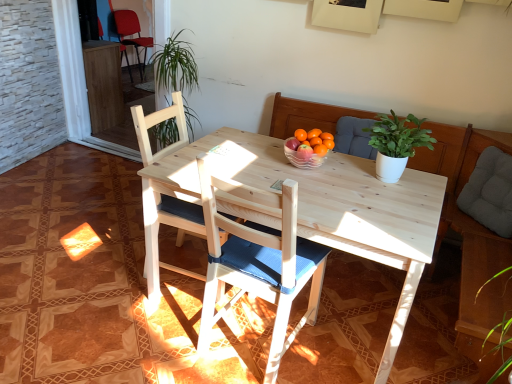
The image size is (512, 384). I want to click on matte red chair at upper left, the third chair in the front-to-back sequence, so click(x=132, y=34).

What do you see at coordinates (259, 262) in the screenshot? This screenshot has width=512, height=384. I see `wooden chair with blue cushion at center, the third chair in the left-to-right sequence` at bounding box center [259, 262].

What do you see at coordinates (169, 225) in the screenshot?
I see `wooden chair at center, which appears as the 2th chair when ordered from the bottom` at bounding box center [169, 225].

You are a GUI agent. You are given a task and a screenshot of the screen. Output one action in this format:
    pyautogui.click(x=<x>, y=<y>)
    Task: Click on the clear glass bowl at center
    The image size is (512, 384).
    Given the screenshot: What is the action you would take?
    pyautogui.click(x=303, y=159)

What do you see at coordinates (303, 159) in the screenshot? The width and height of the screenshot is (512, 384). I see `clear glass bowl at center` at bounding box center [303, 159].

This screenshot has width=512, height=384. I want to click on matte red chair at upper left, the first chair positioned from the back, so click(132, 34).

Which is in front, point (311, 156) or point (148, 47)?

The point (311, 156) is closer to the camera.

From the image's perspective, which one is positioned higher, clear glass bowl at center or matte red chair at upper left, positioned as the first chair in top-to-bottom order?

matte red chair at upper left, positioned as the first chair in top-to-bottom order, appears higher in the image.

Is clear glass bowl at center in contact with matte red chair at upper left, the 3th chair ordered from the bottom?

There is a gap between clear glass bowl at center and matte red chair at upper left, the 3th chair ordered from the bottom.

Between gray fabric cushion at right and clear glass bowl at center, which one is positioned in front?

clear glass bowl at center.

Considering the sizes of objects gray fabric cushion at right and clear glass bowl at center in the image provided, who is smaller, gray fabric cushion at right or clear glass bowl at center?

With smaller size is clear glass bowl at center.

Can you tell me how much gray fabric cushion at right and clear glass bowl at center differ in facing direction?

46.2 degrees.

Could you tell me if gray fabric cushion at right is turned towards clear glass bowl at center?

Yes, gray fabric cushion at right is turned towards clear glass bowl at center.

Does clear glass bowl at center have a larger size compared to wooden chair at center, marked as the second chair in a back-to-front arrangement?

Incorrect, clear glass bowl at center is not larger than wooden chair at center, marked as the second chair in a back-to-front arrangement.

Considering their positions, is clear glass bowl at center located in front of or behind wooden chair at center, which appears as the 2th chair when ordered from the bottom?

In the image, clear glass bowl at center appears behind wooden chair at center, which appears as the 2th chair when ordered from the bottom.

Considering the sizes of objects clear glass bowl at center and wooden chair at center, which is counted as the 2th chair, starting from the front, in the image provided, who is wider, clear glass bowl at center or wooden chair at center, which is counted as the 2th chair, starting from the front,?

With larger width is wooden chair at center, which is counted as the 2th chair, starting from the front.

You are a GUI agent. You are given a task and a screenshot of the screen. Output one action in this format:
    pyautogui.click(x=<x>, y=<y>)
    Task: Click on the 2nd chair counting from the left of the clear glass bowl at center
    Image resolution: width=512 pixels, height=384 pixels.
    Given the screenshot: What is the action you would take?
    tap(169, 225)

Between matte red chair at upper left, the first chair positioned from the back, and clear glass bowl at center, which one has larger size?

matte red chair at upper left, the first chair positioned from the back, is bigger.

From a real-world perspective, is matte red chair at upper left, the 3th chair ordered from the bottom, above or below clear glass bowl at center?

matte red chair at upper left, the 3th chair ordered from the bottom, is below clear glass bowl at center.

The width and height of the screenshot is (512, 384). Identify the location of bowl in front of the matte red chair at upper left, the third chair positioned from the right. (303, 159).

Based on the photo, is matte red chair at upper left, the third chair in the front-to-back sequence, at the left side of clear glass bowl at center?

Yes.

Based on the photo, in terms of width, does gray fabric cushion at right look wider or thinner when compared to wooden chair at center, the 2th chair in the top-to-bottom sequence?

gray fabric cushion at right is thinner than wooden chair at center, the 2th chair in the top-to-bottom sequence.

From a real-world perspective, between gray fabric cushion at right and wooden chair at center, the 2th chair when ordered from left to right, who is vertically lower?

wooden chair at center, the 2th chair when ordered from left to right, from a real-world perspective.

Is gray fabric cushion at right oriented away from wooden chair at center, the 2th chair in the top-to-bottom sequence?

No, gray fabric cushion at right is not facing the opposite direction of wooden chair at center, the 2th chair in the top-to-bottom sequence.

How distant is gray fabric cushion at right from wooden chair at center, which is counted as the 2th chair, starting from the front?

4.70 feet.

From a real-world perspective, is gray fabric cushion at right below matte red chair at upper left, positioned as the first chair in top-to-bottom order?

No, from a real-world perspective, gray fabric cushion at right is not below matte red chair at upper left, positioned as the first chair in top-to-bottom order.

In the scene shown: From the image's perspective, which is above, gray fabric cushion at right or matte red chair at upper left, the third chair positioned from the right?

From the image's view, matte red chair at upper left, the third chair positioned from the right, is above.

What's the angular difference between gray fabric cushion at right and matte red chair at upper left, the 3th chair ordered from the bottom,'s facing directions?

There is a 129-degree angle between the facing directions of gray fabric cushion at right and matte red chair at upper left, the 3th chair ordered from the bottom.

Does point (508, 176) lie behind point (134, 14)?

No, (508, 176) is closer to viewer.

Is wooden chair at center, the 2th chair in the top-to-bottom sequence, to the right of matte red chair at upper left, the first chair positioned from the back, from the viewer's perspective?

Correct, you'll find wooden chair at center, the 2th chair in the top-to-bottom sequence, to the right of matte red chair at upper left, the first chair positioned from the back.

Is wooden chair at center, which is counted as the 2th chair, starting from the front, completely or partially outside of matte red chair at upper left, the third chair positioned from the right?

wooden chair at center, which is counted as the 2th chair, starting from the front, is positioned outside matte red chair at upper left, the third chair positioned from the right.

Is point (154, 156) positioned in front of point (128, 31)?

Yes, point (154, 156) is closer to viewer.

Locate an element on the screen. This screenshot has width=512, height=384. chair that is the 1st one when counting rightward from the matte red chair at upper left, the 1th chair from the left is located at coordinates (169, 225).

Image resolution: width=512 pixels, height=384 pixels. I want to click on bowl lying below the matte red chair at upper left, the 1th chair from the left (from the image's perspective), so click(x=303, y=159).

At what (x,y) coordinates should I click in order to perform the action: click on bowl positioned vertically above the gray fabric cushion at right (from a real-world perspective). Please return your answer as a coordinate pair (x, y). The image size is (512, 384). Looking at the image, I should click on [303, 159].

Estimate the real-world distances between objects in this image. Which object is closer to wooden chair at center, which appears as the 2th chair when ordered from the bottom, matte red chair at upper left, the 3th chair ordered from the bottom, or clear glass bowl at center?

clear glass bowl at center is closer to wooden chair at center, which appears as the 2th chair when ordered from the bottom.

Which object lies further to the anchor point matte red chair at upper left, the first chair positioned from the back, gray fabric cushion at right or clear glass bowl at center?

gray fabric cushion at right is positioned further to the anchor matte red chair at upper left, the first chair positioned from the back.

Based on their spatial positions, is wooden chair at center, the 2th chair when ordered from left to right, or white matte plant at upper center closer to gray fabric cushion at right?

The object closer to gray fabric cushion at right is white matte plant at upper center.

Which object lies nearer to the anchor point wooden chair with blue cushion at center, which is the 1th chair in front-to-back order, wooden chair at center, the 2th chair in the top-to-bottom sequence, or gray fabric cushion at right?

wooden chair at center, the 2th chair in the top-to-bottom sequence, lies closer to wooden chair with blue cushion at center, which is the 1th chair in front-to-back order, than the other object.

From the image, which object appears to be farther from gray fabric cushion at right, clear glass bowl at center or wooden chair with blue cushion at center, the third chair from the top?

wooden chair with blue cushion at center, the third chair from the top.

From the image, which object appears to be nearer to wooden chair at center, the second chair positioned from the right, wooden chair with blue cushion at center, the first chair when ordered from right to left, or clear glass bowl at center?

Based on the image, wooden chair with blue cushion at center, the first chair when ordered from right to left, appears to be nearer to wooden chair at center, the second chair positioned from the right.

Which object lies further to the anchor point matte red chair at upper left, positioned as the first chair in top-to-bottom order, white matte plant at upper center or wooden chair at center, the 2th chair when ordered from left to right?

The object further to matte red chair at upper left, positioned as the first chair in top-to-bottom order, is white matte plant at upper center.

Based on their spatial positions, is gray fabric cushion at right or matte red chair at upper left, the third chair in the front-to-back sequence, closer to wooden chair at center, the second chair positioned from the right?

The object closer to wooden chair at center, the second chair positioned from the right, is gray fabric cushion at right.

The width and height of the screenshot is (512, 384). In order to click on houseplant between wooden chair with blue cushion at center, arranged as the first chair when ordered from the bottom, and clear glass bowl at center in the front-back direction in this screenshot , I will do `click(396, 144)`.

Locate an element on the screen. This screenshot has height=384, width=512. chair between wooden chair at center, the second chair positioned from the right, and white matte plant at upper center, in the horizontal direction is located at coordinates (259, 262).

What are the coordinates of `pillow between clear glass bowl at center and matte red chair at upper left, the third chair in the front-to-back sequence, along the z-axis` in the screenshot? It's located at (490, 192).

Image resolution: width=512 pixels, height=384 pixels. What are the coordinates of `houseplant located between wooden chair with blue cushion at center, arranged as the first chair when ordered from the bottom, and gray fabric cushion at right in the left-right direction` in the screenshot? It's located at (396, 144).